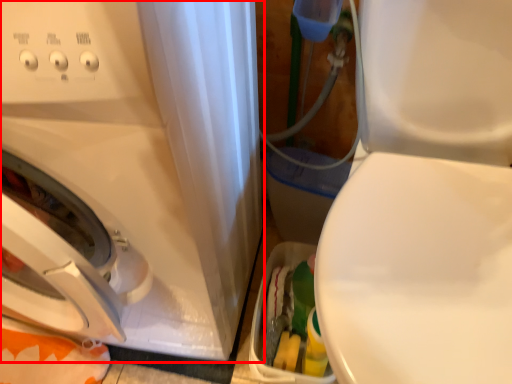
Question: From the image's perspective, where is washing machine (annotated by the red box) located in relation to machine in the image?

Choices:
 (A) above
 (B) below

Answer: (A)